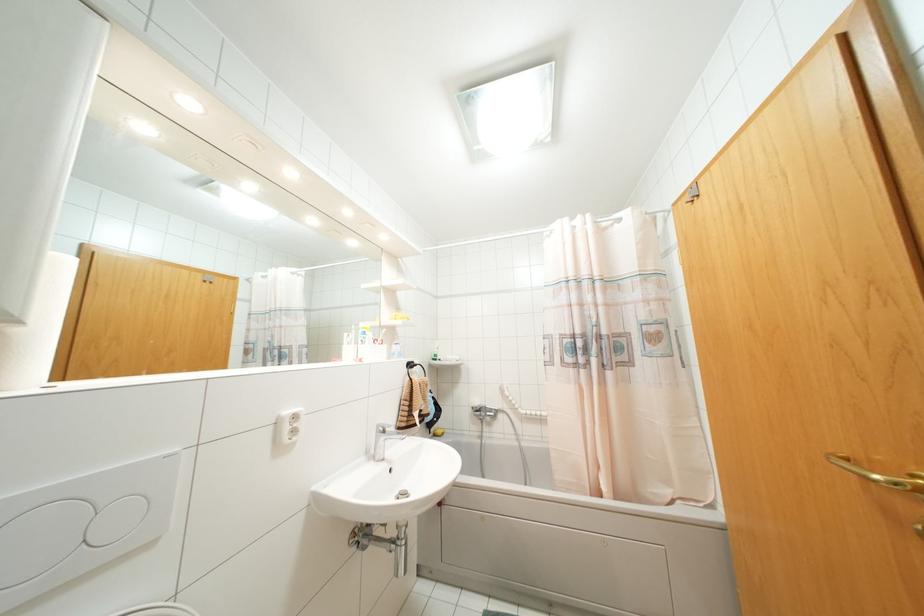
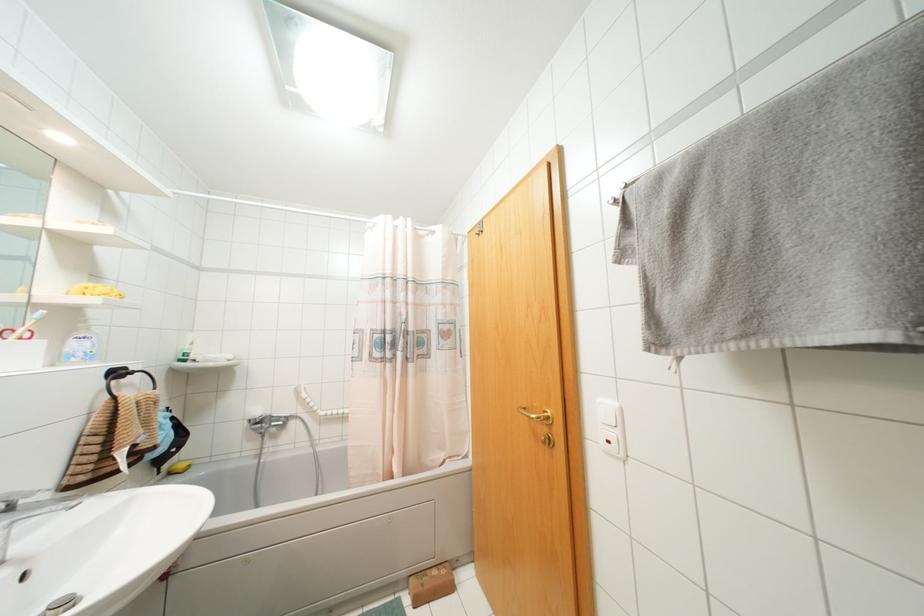
Find the pixel in the second image that matches pixel 476 402 in the first image.

(258, 411)